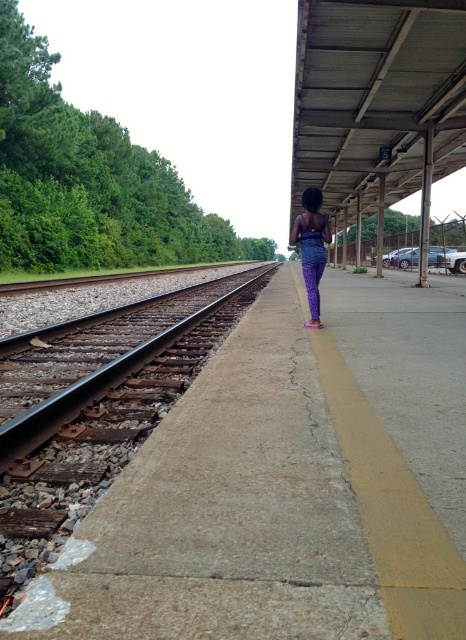
Question: Which point is closer to the camera?

Choices:
 (A) (143, 362)
 (B) (324, 248)

Answer: (A)

Question: Is brown gravel track at left positioned at the back of purple fabric pants at center?

Choices:
 (A) yes
 (B) no

Answer: (B)

Question: Can you confirm if brown gravel track at left is bigger than purple fabric pants at center?

Choices:
 (A) yes
 (B) no

Answer: (A)

Question: Is brown gravel track at left wider than purple fabric pants at center?

Choices:
 (A) yes
 (B) no

Answer: (A)

Question: Which object appears farthest from the camera in this image?

Choices:
 (A) brown gravel track at left
 (B) purple fabric pants at center

Answer: (B)